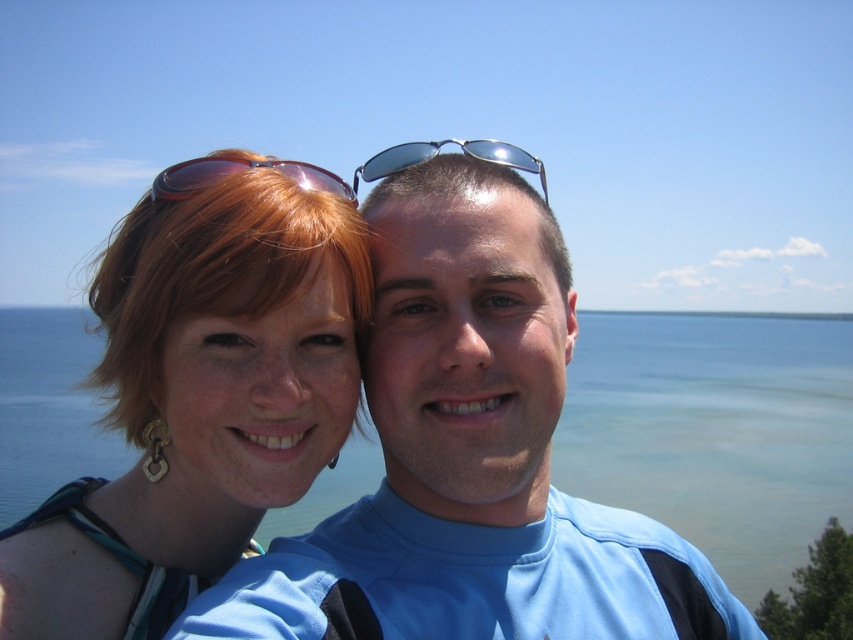
Who is positioned more to the left, matte red sunglasses at upper left or metallic reflective sunglasses at center?

matte red sunglasses at upper left

Is matte red sunglasses at upper left positioned behind metallic reflective sunglasses at center?

Yes, matte red sunglasses at upper left is further from the viewer.

Based on the photo, who is more distant from viewer, (155, 186) or (415, 163)?

Positioned behind is point (155, 186).

This screenshot has width=853, height=640. What are the coordinates of `matte red sunglasses at upper left` in the screenshot? It's located at (241, 170).

Between matte gold hoop earrings at center and metallic reflective sunglasses at center, which one appears on the left side from the viewer's perspective?

From the viewer's perspective, matte gold hoop earrings at center appears more on the left side.

Can you confirm if matte gold hoop earrings at center is bigger than metallic reflective sunglasses at center?

Actually, matte gold hoop earrings at center might be smaller than metallic reflective sunglasses at center.

The width and height of the screenshot is (853, 640). What do you see at coordinates (199, 401) in the screenshot?
I see `matte gold hoop earrings at center` at bounding box center [199, 401].

You are a GUI agent. You are given a task and a screenshot of the screen. Output one action in this format:
    pyautogui.click(x=<x>, y=<y>)
    Task: Click on the matte gold hoop earrings at center
    This screenshot has width=853, height=640.
    Given the screenshot: What is the action you would take?
    pyautogui.click(x=199, y=401)

Does point (279, 429) come behind point (316, 168)?

That is True.

This screenshot has width=853, height=640. Describe the element at coordinates (199, 401) in the screenshot. I see `matte gold hoop earrings at center` at that location.

The width and height of the screenshot is (853, 640). I want to click on matte gold hoop earrings at center, so click(199, 401).